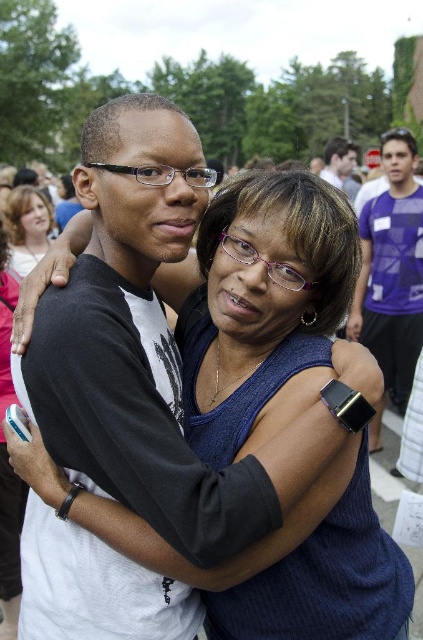
Can you confirm if purple fabric shirt at right is positioned to the right of matte black hair at upper left?

Yes, purple fabric shirt at right is to the right of matte black hair at upper left.

What do you see at coordinates (392, 275) in the screenshot? This screenshot has width=423, height=640. I see `purple fabric shirt at right` at bounding box center [392, 275].

I want to click on purple fabric shirt at right, so (392, 275).

Does purple fabric shirt at right lie in front of matte black watch at upper right?

That is True.

Image resolution: width=423 pixels, height=640 pixels. In order to click on purple fabric shirt at right in this screenshot , I will do pyautogui.click(x=392, y=275).

Is matte black hair at upper left behind matte black watch at upper right?

No, it is in front of matte black watch at upper right.

Is matte black hair at upper left shorter than matte black watch at upper right?

Indeed, matte black hair at upper left has a lesser height compared to matte black watch at upper right.

Does point (16, 196) lie behind point (332, 157)?

No, (16, 196) is closer to viewer.

Locate an element on the screen. The image size is (423, 640). matte black hair at upper left is located at coordinates (27, 227).